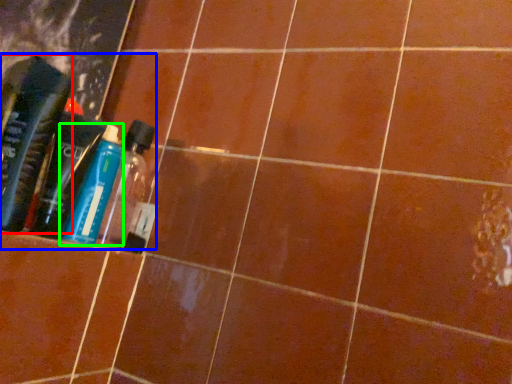
Question: Which is farther away from bottle (highlighted by a red box)? product (highlighted by a blue box) or bottle (highlighted by a green box)?

Choices:
 (A) product
 (B) bottle

Answer: (B)